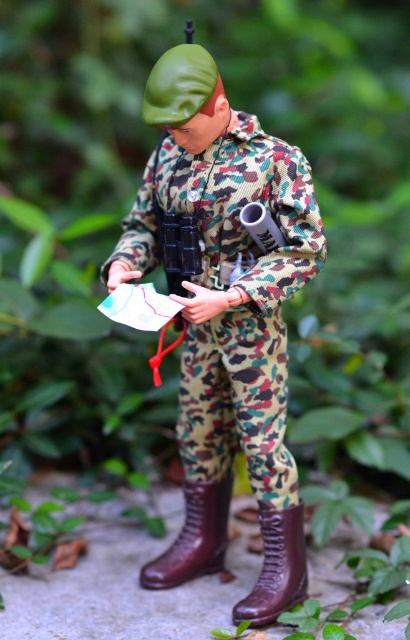
Question: Is camo fabric uniform at center bigger than brown leather boot at lower center?

Choices:
 (A) yes
 (B) no

Answer: (A)

Question: Is camo fabric uniform at center to the right of brown leather boot at lower center from the viewer's perspective?

Choices:
 (A) no
 (B) yes

Answer: (B)

Question: Which point is closer to the camera taking this photo?

Choices:
 (A) (271, 406)
 (B) (186, 564)

Answer: (A)

Question: Among these points, which one is nearest to the camera?

Choices:
 (A) (278, 564)
 (B) (223, 497)

Answer: (A)

Question: Which is farther from the camo fabric uniform at center?

Choices:
 (A) leather at center
 (B) brown leather boot at lower center

Answer: (A)

Question: Is the position of brown leather boot at lower center more distant than that of leather at center?

Choices:
 (A) yes
 (B) no

Answer: (A)